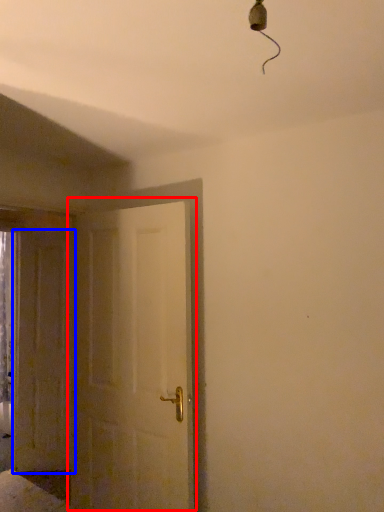
Question: Among these objects, which one is farthest to the camera, door (highlighted by a red box) or door (highlighted by a blue box)?

Choices:
 (A) door
 (B) door

Answer: (B)